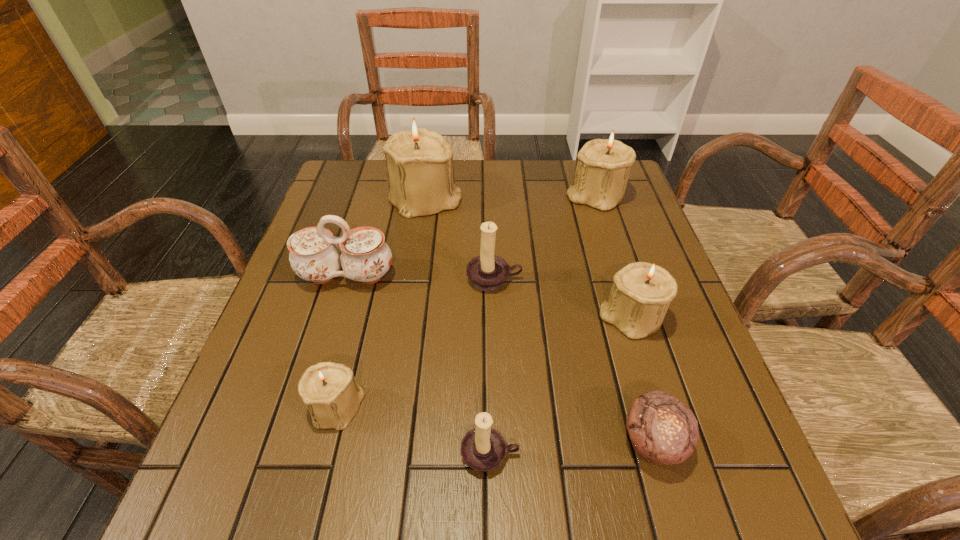
Identify the location of free point between the shortest object and the third nearest candle holder. (642, 380).

The width and height of the screenshot is (960, 540). In order to click on vacant space that's between the nearest candle holder and the third farthest beige candle_holder in this screenshot , I will do `click(561, 386)`.

What are the coordinates of `free space between the chinaware and the nearest candle holder` in the screenshot? It's located at (419, 365).

Find the location of a particular element. The width and height of the screenshot is (960, 540). empty space between the chinaware and the fourth nearest candle holder is located at coordinates (420, 278).

Identify the location of empty space between the fourth nearest candle holder and the tallest candle holder. (460, 239).

Choose which object is the fourth nearest neighbor to the third farthest candle holder. Please provide its 2D coordinates. Your answer should be formatted as a tuple, i.e. [(x, y)], where the tuple contains the x and y coordinates of a point satisfying the conditions above.

[(603, 166)]

You are a GUI agent. You are given a task and a screenshot of the screen. Output one action in this format:
    pyautogui.click(x=<x>, y=<y>)
    Task: Click on the object that ranks as the fourth closest to the muffin
    The image size is (960, 540).
    Given the screenshot: What is the action you would take?
    pyautogui.click(x=332, y=395)

Where is `candle holder that stands as the closest to the third biggest beige candle_holder`? candle holder that stands as the closest to the third biggest beige candle_holder is located at coordinates (488, 272).

Identify which candle holder is the fifth closest to the farther brown candle holder. Please provide its 2D coordinates. Your answer should be formatted as a tuple, i.e. [(x, y)], where the tuple contains the x and y coordinates of a point satisfying the conditions above.

[(483, 448)]

You are a GUI agent. You are given a task and a screenshot of the screen. Output one action in this format:
    pyautogui.click(x=<x>, y=<y>)
    Task: Click on the beige candle_holder that stands as the fourth closest to the fourth nearest candle holder
    
    Given the screenshot: What is the action you would take?
    pyautogui.click(x=332, y=395)